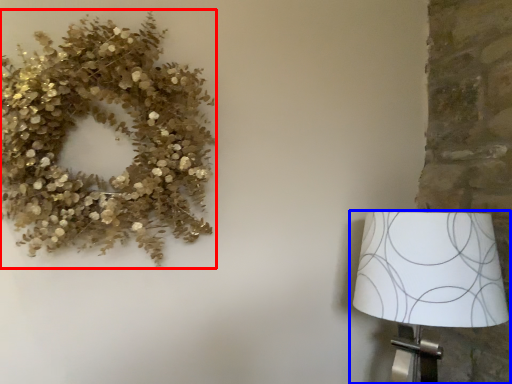
Question: Which object appears farthest to the camera in this image, floral arrangement (highlighted by a red box) or lamp (highlighted by a blue box)?

Choices:
 (A) floral arrangement
 (B) lamp

Answer: (B)